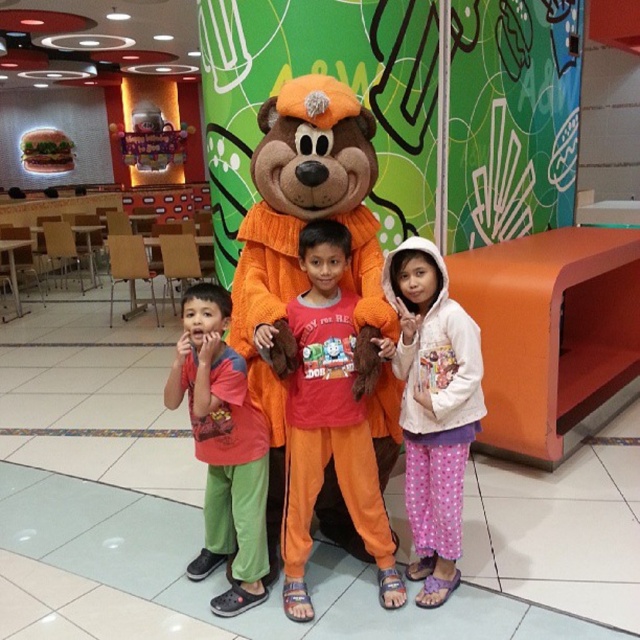
Question: Which object is positioned farthest from the red-orange t-shirt at center?

Choices:
 (A) orange plush toy at center
 (B) white fleece hoodie at center

Answer: (B)

Question: Does orange plush toy at center come in front of red-orange t-shirt at center?

Choices:
 (A) yes
 (B) no

Answer: (A)

Question: Is orange plush toy at center thinner than white fleece hoodie at center?

Choices:
 (A) yes
 (B) no

Answer: (B)

Question: Which point is closer to the camera taking this photo?

Choices:
 (A) (444, 500)
 (B) (179, 349)
 (C) (289, 528)

Answer: (B)

Question: Is white fleece hoodie at center wider than red-orange t-shirt at center?

Choices:
 (A) no
 (B) yes

Answer: (B)

Question: Which point appears closest to the camera in this image?

Choices:
 (A) (244, 422)
 (B) (480, 419)

Answer: (B)